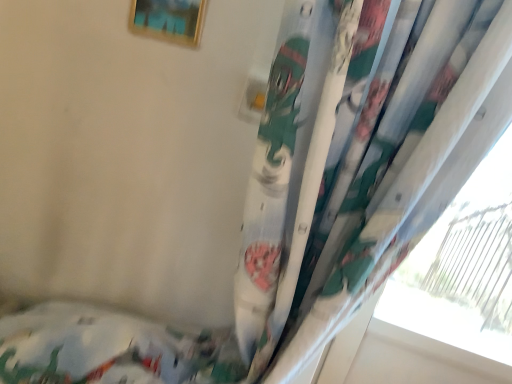
Question: Does white cotton bed at lower left have a lesser height compared to gold metallic picture frame at upper center?

Choices:
 (A) no
 (B) yes

Answer: (A)

Question: Is white cotton bed at lower left further to the viewer compared to gold metallic picture frame at upper center?

Choices:
 (A) no
 (B) yes

Answer: (B)

Question: Is white cotton bed at lower left to the left of gold metallic picture frame at upper center from the viewer's perspective?

Choices:
 (A) no
 (B) yes

Answer: (B)

Question: From the image's perspective, is white cotton bed at lower left over gold metallic picture frame at upper center?

Choices:
 (A) no
 (B) yes

Answer: (A)

Question: Is gold metallic picture frame at upper center at the back of white cotton bed at lower left?

Choices:
 (A) no
 (B) yes

Answer: (A)

Question: Does white cotton bed at lower left have a smaller size compared to gold metallic picture frame at upper center?

Choices:
 (A) yes
 (B) no

Answer: (B)

Question: From the image's perspective, is gold metallic picture frame at upper center beneath white cotton bed at lower left?

Choices:
 (A) no
 (B) yes

Answer: (A)

Question: Is gold metallic picture frame at upper center at the left side of white cotton bed at lower left?

Choices:
 (A) no
 (B) yes

Answer: (A)

Question: Considering the relative positions of gold metallic picture frame at upper center and white cotton bed at lower left in the image provided, is gold metallic picture frame at upper center behind white cotton bed at lower left?

Choices:
 (A) yes
 (B) no

Answer: (B)

Question: Is gold metallic picture frame at upper center completely or partially outside of white cotton bed at lower left?

Choices:
 (A) yes
 (B) no

Answer: (A)

Question: Can you confirm if gold metallic picture frame at upper center is thinner than white cotton bed at lower left?

Choices:
 (A) yes
 (B) no

Answer: (A)

Question: From a real-world perspective, is gold metallic picture frame at upper center located beneath white cotton bed at lower left?

Choices:
 (A) no
 (B) yes

Answer: (A)

Question: In the image, is gold metallic picture frame at upper center positioned in front of or behind white cotton bed at lower left?

Choices:
 (A) front
 (B) behind

Answer: (A)